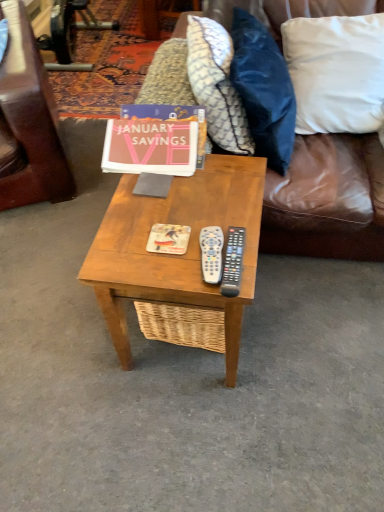
Find the location of a particular element. white cotton pillow at upper right, the first pillow viewed from the right is located at coordinates (336, 72).

The image size is (384, 512). Describe the element at coordinates (336, 72) in the screenshot. I see `white cotton pillow at upper right, the first pillow viewed from the right` at that location.

Describe the element at coordinates (327, 200) in the screenshot. The width and height of the screenshot is (384, 512). I see `brown leather couch at upper right` at that location.

Describe the element at coordinates (211, 253) in the screenshot. I see `white plastic remote at center, marked as the second remote in a right-to-left arrangement` at that location.

Where is `patterned fabric pillow at upper center, marked as the 1th pillow in a left-to-right arrangement`? The height and width of the screenshot is (512, 384). patterned fabric pillow at upper center, marked as the 1th pillow in a left-to-right arrangement is located at coordinates (216, 84).

What is the approximate width of black plastic remote at right, which appears as the 2th remote when viewed from the left?

black plastic remote at right, which appears as the 2th remote when viewed from the left, is 8.81 inches in width.

The image size is (384, 512). Identify the location of black plastic remote at right, marked as the first remote in a right-to-left arrangement. (233, 262).

Find the location of a particular element. white cotton pillow at upper right, acting as the third pillow starting from the left is located at coordinates (336, 72).

Between matte orange magazine at center and patterned fabric pillow at upper center, the 3th pillow when ordered from right to left, which one has smaller size?

matte orange magazine at center.

Consider the image. From the image's perspective, would you say matte orange magazine at center is shown under patterned fabric pillow at upper center, the 3th pillow when ordered from right to left?

Yes.

Which point is more forward, (x=164, y=244) or (x=215, y=108)?

The point (x=164, y=244) is in front.

Is matte orange magazine at center inside the boundaries of patterned fabric pillow at upper center, the 3th pillow when ordered from right to left, or outside?

matte orange magazine at center is not enclosed by patterned fabric pillow at upper center, the 3th pillow when ordered from right to left.

From the image's perspective, is black plastic remote at right, marked as the first remote in a right-to-left arrangement, positioned above or below white cotton pillow at upper right, acting as the third pillow starting from the left?

black plastic remote at right, marked as the first remote in a right-to-left arrangement, is below white cotton pillow at upper right, acting as the third pillow starting from the left.

Considering the sizes of objects black plastic remote at right, marked as the first remote in a right-to-left arrangement, and white cotton pillow at upper right, the first pillow viewed from the right, in the image provided, who is smaller, black plastic remote at right, marked as the first remote in a right-to-left arrangement, or white cotton pillow at upper right, the first pillow viewed from the right,?

black plastic remote at right, marked as the first remote in a right-to-left arrangement.

From a real-world perspective, is black plastic remote at right, which appears as the 2th remote when viewed from the left, physically located above or below white cotton pillow at upper right, acting as the third pillow starting from the left?

In terms of real-world spatial position, black plastic remote at right, which appears as the 2th remote when viewed from the left, is above white cotton pillow at upper right, acting as the third pillow starting from the left.

Which is closer to the camera, (236,240) or (329,34)?

Clearly, point (236,240) is closer to the camera than point (329,34).

How much distance is there between white fabric pillow at upper right, the 2th pillow from the left, and white cotton pillow at upper right, the first pillow viewed from the right?

A distance of 8.68 inches exists between white fabric pillow at upper right, the 2th pillow from the left, and white cotton pillow at upper right, the first pillow viewed from the right.

Is white fabric pillow at upper right, which appears as the second pillow when viewed from the right, aimed at white cotton pillow at upper right, the first pillow viewed from the right?

Yes, white fabric pillow at upper right, which appears as the second pillow when viewed from the right, is oriented towards white cotton pillow at upper right, the first pillow viewed from the right.

From the image's perspective, does white fabric pillow at upper right, the 2th pillow from the left, appear lower than white cotton pillow at upper right, acting as the third pillow starting from the left?

Yes, from the image's perspective, white fabric pillow at upper right, the 2th pillow from the left, is beneath white cotton pillow at upper right, acting as the third pillow starting from the left.

Considering the sizes of objects white fabric pillow at upper right, the 2th pillow from the left, and white cotton pillow at upper right, acting as the third pillow starting from the left, in the image provided, who is taller, white fabric pillow at upper right, the 2th pillow from the left, or white cotton pillow at upper right, acting as the third pillow starting from the left,?

white fabric pillow at upper right, the 2th pillow from the left, is taller.

Between patterned fabric pillow at upper center, the 3th pillow when ordered from right to left, and pink matte paper at center, which one has larger width?

patterned fabric pillow at upper center, the 3th pillow when ordered from right to left, is wider.

From the picture: From the image's perspective, who appears lower, patterned fabric pillow at upper center, marked as the 1th pillow in a left-to-right arrangement, or pink matte paper at center?

From the image's view, pink matte paper at center is below.

The height and width of the screenshot is (512, 384). Find the location of `the 1st pillow in front of the pink matte paper at center`. the 1st pillow in front of the pink matte paper at center is located at coordinates (216, 84).

Based on their positions, is patterned fabric pillow at upper center, the 3th pillow when ordered from right to left, located to the left or right of pink matte paper at center?

In the image, patterned fabric pillow at upper center, the 3th pillow when ordered from right to left, appears on the right side of pink matte paper at center.

Is woodenwoodencoffee table at center a part of white cotton pillow at upper right, the first pillow viewed from the right?

That's incorrect, woodenwoodencoffee table at center is not inside white cotton pillow at upper right, the first pillow viewed from the right.

Is the depth of white cotton pillow at upper right, acting as the third pillow starting from the left, less than that of woodenwoodencoffee table at center?

No, the depth of white cotton pillow at upper right, acting as the third pillow starting from the left, is greater than that of woodenwoodencoffee table at center.

Considering the points (316, 126) and (122, 359), which point is behind, point (316, 126) or point (122, 359)?

Point (316, 126)

Between white cotton pillow at upper right, the first pillow viewed from the right, and woodenwoodencoffee table at center, which one has less height?

white cotton pillow at upper right, the first pillow viewed from the right.

Is brown leather couch at upper right outside of pink matte paper at center?

Indeed, brown leather couch at upper right is completely outside pink matte paper at center.

Considering the relative positions of brown leather couch at upper right and pink matte paper at center in the image provided, is brown leather couch at upper right to the left of pink matte paper at center from the viewer's perspective?

Incorrect, brown leather couch at upper right is not on the left side of pink matte paper at center.

Is brown leather couch at upper right not near pink matte paper at center?

They are positioned close to each other.

Considering the sizes of pink matte paper at center and white cotton pillow at upper right, acting as the third pillow starting from the left, in the image, is pink matte paper at center wider or thinner than white cotton pillow at upper right, acting as the third pillow starting from the left,?

pink matte paper at center is thinner than white cotton pillow at upper right, acting as the third pillow starting from the left.

Is pink matte paper at center facing away from white cotton pillow at upper right, acting as the third pillow starting from the left?

No, pink matte paper at center is not facing away from white cotton pillow at upper right, acting as the third pillow starting from the left.

In the scene shown: From a real-world perspective, is pink matte paper at center physically located above or below white cotton pillow at upper right, acting as the third pillow starting from the left?

From a real-world perspective, pink matte paper at center is physically above white cotton pillow at upper right, acting as the third pillow starting from the left.

Which of these two, pink matte paper at center or white cotton pillow at upper right, the first pillow viewed from the right, stands taller?

Standing taller between the two is white cotton pillow at upper right, the first pillow viewed from the right.

Find the location of a particular element. This screenshot has height=512, width=384. magazine on the left of the patterned fabric pillow at upper center, marked as the 1th pillow in a left-to-right arrangement is located at coordinates (168, 239).

Find the location of a particular element. the 2nd remote below the white cotton pillow at upper right, acting as the third pillow starting from the left (from the image's perspective) is located at coordinates click(x=233, y=262).

Considering their positions, is white cotton pillow at upper right, the first pillow viewed from the right, positioned further to patterned fabric pillow at upper center, marked as the 1th pillow in a left-to-right arrangement, than white fabric pillow at upper right, which appears as the second pillow when viewed from the right?

Among the two, white cotton pillow at upper right, the first pillow viewed from the right, is located further to patterned fabric pillow at upper center, marked as the 1th pillow in a left-to-right arrangement.

Estimate the real-world distances between objects in this image. Which object is further from black plastic remote at right, which appears as the 2th remote when viewed from the left, matte orange magazine at center or pink matte paper at center?

Based on the image, pink matte paper at center appears to be further to black plastic remote at right, which appears as the 2th remote when viewed from the left.

From the picture: Looking at the image, which one is located further to white fabric pillow at upper right, the 2th pillow from the left, matte orange magazine at center or black plastic remote at right, marked as the first remote in a right-to-left arrangement?

The object further to white fabric pillow at upper right, the 2th pillow from the left, is matte orange magazine at center.

When comparing their distances from matte orange magazine at center, does white plastic remote at center, which is the first remote from left to right, or black plastic remote at right, which appears as the 2th remote when viewed from the left, seem closer?

white plastic remote at center, which is the first remote from left to right, is positioned closer to the anchor matte orange magazine at center.

When comparing their distances from woodenwoodencoffee table at center, does pink matte paper at center or white fabric pillow at upper right, which appears as the second pillow when viewed from the right, seem closer?

pink matte paper at center is positioned closer to the anchor woodenwoodencoffee table at center.

From the image, which object appears to be farther from woodenwoodencoffee table at center, brown leather couch at upper right or patterned fabric pillow at upper center, marked as the 1th pillow in a left-to-right arrangement?

brown leather couch at upper right is positioned further to the anchor woodenwoodencoffee table at center.

Considering their positions, is white plastic remote at center, which is the first remote from left to right, positioned closer to woodenwoodencoffee table at center than black plastic remote at right, marked as the first remote in a right-to-left arrangement?

white plastic remote at center, which is the first remote from left to right.

Considering their positions, is matte orange magazine at center positioned closer to woodenwoodencoffee table at center than white cotton pillow at upper right, acting as the third pillow starting from the left?

The object closer to woodenwoodencoffee table at center is matte orange magazine at center.

This screenshot has height=512, width=384. I want to click on coffee table located between pink matte paper at center and white cotton pillow at upper right, the first pillow viewed from the right, in the left-right direction, so click(175, 255).

The height and width of the screenshot is (512, 384). I want to click on pillow between pink matte paper at center and white fabric pillow at upper right, the 2th pillow from the left, so click(216, 84).

Where is `magazine that lies between white fabric pillow at upper right, which appears as the second pillow when viewed from the right, and woodenwoodencoffee table at center from top to bottom`? magazine that lies between white fabric pillow at upper right, which appears as the second pillow when viewed from the right, and woodenwoodencoffee table at center from top to bottom is located at coordinates (168, 239).

The height and width of the screenshot is (512, 384). Identify the location of paperback book that lies between patterned fabric pillow at upper center, marked as the 1th pillow in a left-to-right arrangement, and woodenwoodencoffee table at center from top to bottom. click(150, 147).